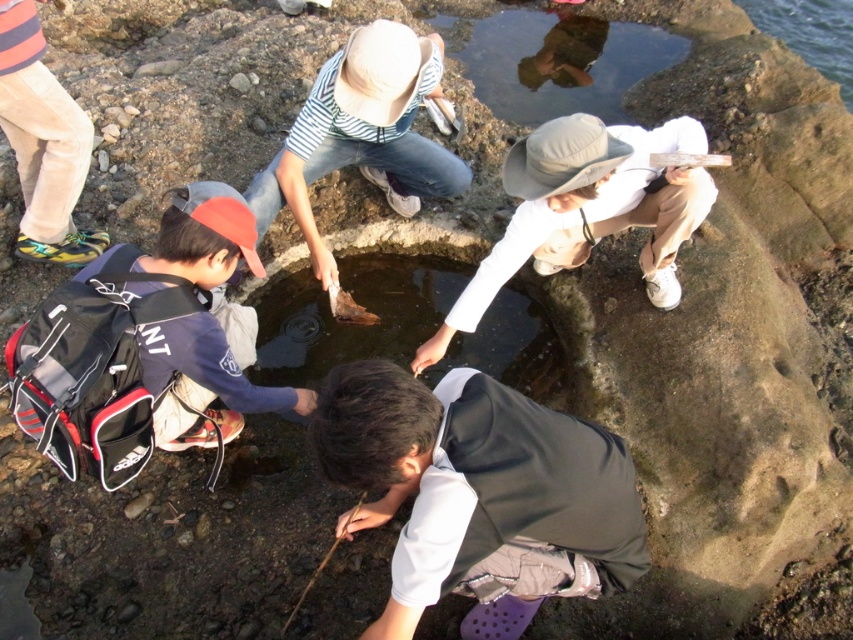
You are a photographer standing at the edge of the rocky shoreline. You want to take a photo of the white matte vest at center and the white matte hat at center so that both are in focus. The camera you are using has a depth of field that can cover objects within a 36 inch range. Can you capture both objects in focus without adjusting your camera settings?

The white matte vest at center and white matte hat at center are 36.83 inches apart from each other. Since the camera can cover 36 inches, the distance between them is slightly beyond the camera range. Therefore, you cannot capture both in focus without adjusting your settings.

You are standing at the edge of the rocky shoreline and see the white matte vest at center and the white matte hat at center. Which one is positioned more to the left side from your perspective?

The white matte vest at center is positioned more to the left side from your perspective.